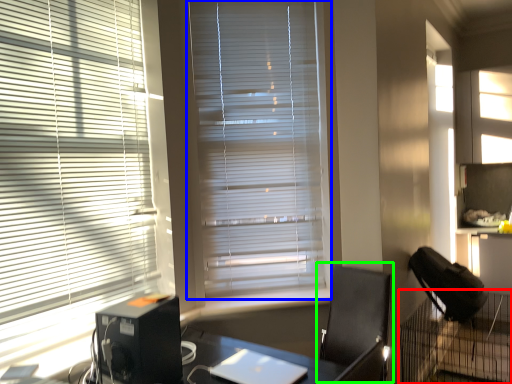
Question: Which object is positioned closest to computer desk (highlighted by a red box)? Select from window blind (highlighted by a blue box) and computer chair (highlighted by a green box).

Choices:
 (A) window blind
 (B) computer chair

Answer: (B)